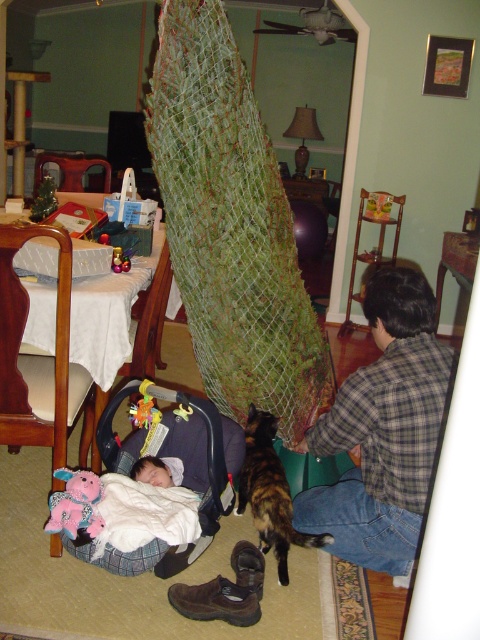
Consider the image. Which of these two, plaid shirt at lower right or soft white blanket at lower left, stands taller?

Standing taller between the two is plaid shirt at lower right.

Is point (327, 419) more distant than point (156, 465)?

No.

Where is `plaid shirt at lower right`? This screenshot has height=640, width=480. plaid shirt at lower right is located at coordinates (383, 429).

Is green netted tree at center positioned in front of calico fur cat at lower center?

That is False.

Is the position of green netted tree at center more distant than that of calico fur cat at lower center?

That is True.

Is point (303, 346) less distant than point (289, 534)?

No, it is not.

The width and height of the screenshot is (480, 640). Find the location of `green netted tree at center`. green netted tree at center is located at coordinates (230, 225).

Is point (15, 317) positioned after point (143, 461)?

That is False.

Is wooden chair at lower left thinner than white soft blanket at center?

Correct, wooden chair at lower left's width is less than white soft blanket at center's.

Who is more forward, (12, 221) or (113, 476)?

Positioned in front is point (113, 476).

This screenshot has width=480, height=640. I want to click on wooden chair at lower left, so click(x=39, y=358).